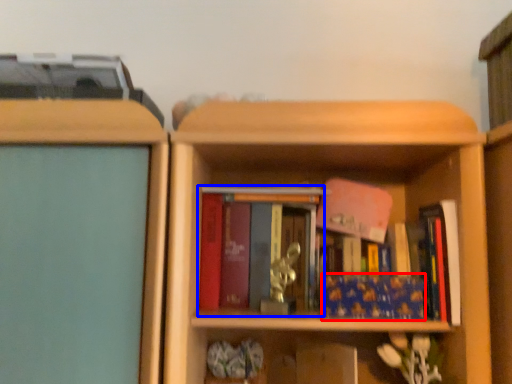
Question: Which object is further to the camera taking this photo, book (highlighted by a red box) or book (highlighted by a blue box)?

Choices:
 (A) book
 (B) book

Answer: (B)